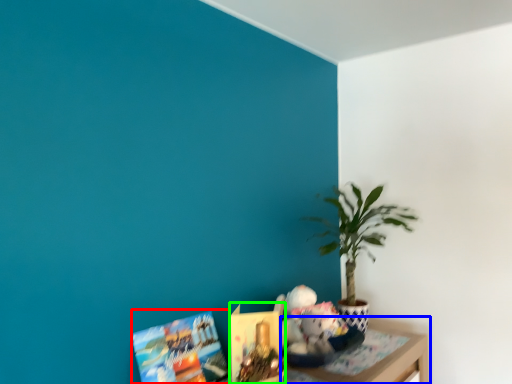
Question: Based on their relative distances, which object is nearer to book (highlighted by a red box)? Choose from table (highlighted by a blue box) and book (highlighted by a green box).

Choices:
 (A) table
 (B) book

Answer: (B)